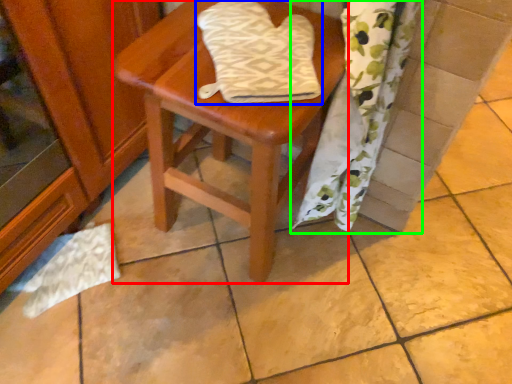
Question: Estimate the real-world distances between objects in this image. Which object is closer to stool (highlighted by a red box), beach towel (highlighted by a blue box) or curtain (highlighted by a green box)?

Choices:
 (A) beach towel
 (B) curtain

Answer: (A)